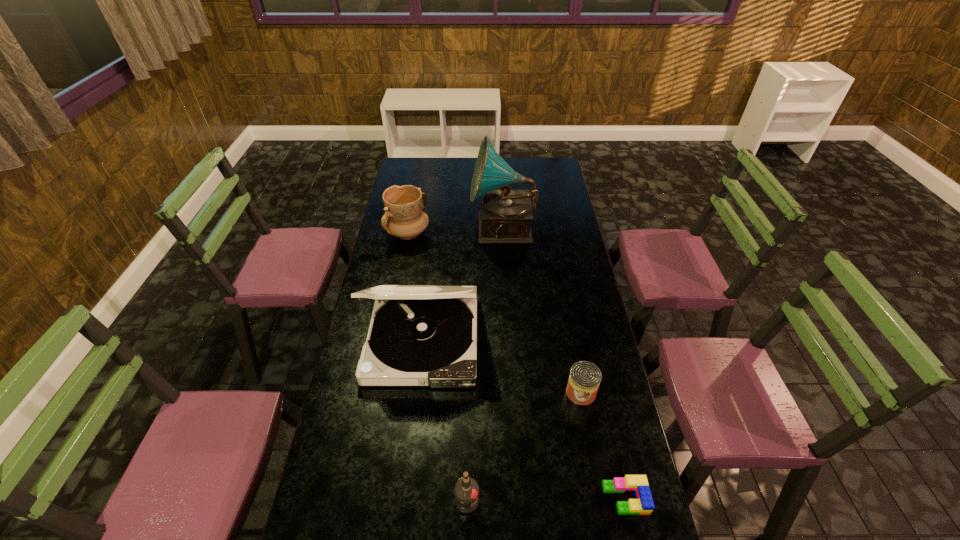
The image size is (960, 540). In order to click on vacant space located on the right of the third tallest object in this screenshot , I will do `click(492, 233)`.

Identify the location of vacant point located on the front label of the vodka. (582, 501).

Identify the location of vacant space located on the back of the can. (575, 362).

Locate an element on the screen. Image resolution: width=960 pixels, height=540 pixels. vacant region located on the left of the shortest object is located at coordinates (474, 498).

You are a GUI agent. You are given a task and a screenshot of the screen. Output one action in this format:
    pyautogui.click(x=<x>, y=<y>)
    Task: Click on the CD player situated at the left edge
    This screenshot has width=960, height=540.
    Given the screenshot: What is the action you would take?
    pyautogui.click(x=420, y=335)

I want to click on pottery that is positioned at the left edge, so click(404, 217).

The image size is (960, 540). Identify the location of can located in the right edge section of the desktop. (585, 377).

This screenshot has height=540, width=960. I want to click on Lego present at the right edge, so click(x=643, y=504).

This screenshot has height=540, width=960. Identify the location of vacant region at the left edge of the desktop. (354, 385).

Where is `free region at the right edge of the desktop`? free region at the right edge of the desktop is located at coordinates (592, 293).